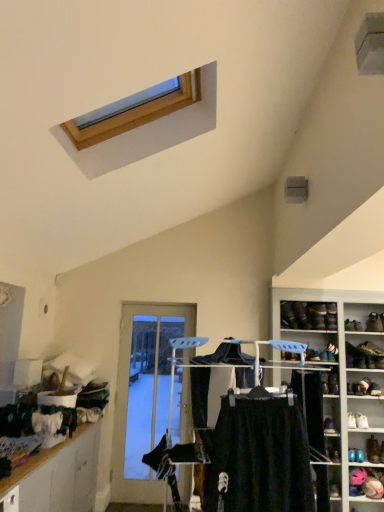
Question: From the image's perspective, is wooden cabinet at lower left located beneath black leather shoe at upper right, arranged as the first footwear when viewed from the top?

Choices:
 (A) yes
 (B) no

Answer: (A)

Question: Considering the relative positions of wooden cabinet at lower left and black leather shoe at upper right, placed as the 5th footwear when sorted from bottom to top, in the image provided, is wooden cabinet at lower left to the left of black leather shoe at upper right, placed as the 5th footwear when sorted from bottom to top, from the viewer's perspective?

Choices:
 (A) yes
 (B) no

Answer: (A)

Question: Considering the relative sizes of wooden cabinet at lower left and black leather shoe at upper right, placed as the 5th footwear when sorted from bottom to top, in the image provided, is wooden cabinet at lower left shorter than black leather shoe at upper right, placed as the 5th footwear when sorted from bottom to top,?

Choices:
 (A) no
 (B) yes

Answer: (A)

Question: Is black leather shoe at upper right, placed as the 5th footwear when sorted from bottom to top, at the back of wooden cabinet at lower left?

Choices:
 (A) no
 (B) yes

Answer: (A)

Question: From a real-world perspective, is wooden cabinet at lower left positioned under black leather shoe at upper right, arranged as the first footwear when viewed from the top, based on gravity?

Choices:
 (A) yes
 (B) no

Answer: (A)

Question: Does wooden cabinet at lower left touch black leather shoe at upper right, placed as the 5th footwear when sorted from bottom to top?

Choices:
 (A) yes
 (B) no

Answer: (B)

Question: From the image's perspective, is black leather shoe at upper right, arranged as the 7th shoe when viewed from the right, beneath wooden cabinet at lower left?

Choices:
 (A) no
 (B) yes

Answer: (A)

Question: Is black leather shoe at upper right, arranged as the 7th shoe when viewed from the right, in front of wooden cabinet at lower left?

Choices:
 (A) no
 (B) yes

Answer: (A)

Question: Is black leather shoe at upper right, arranged as the 7th shoe when viewed from the right, not within wooden cabinet at lower left?

Choices:
 (A) no
 (B) yes

Answer: (B)

Question: Can you confirm if black leather shoe at upper right, the 1th shoe positioned from the left, is shorter than wooden cabinet at lower left?

Choices:
 (A) no
 (B) yes

Answer: (B)

Question: From the image's perspective, is black leather shoe at upper right, which is counted as the 2th shoe, starting from the top, on wooden cabinet at lower left?

Choices:
 (A) yes
 (B) no

Answer: (A)

Question: Considering the relative sizes of black leather shoe at upper right, arranged as the 7th shoe when viewed from the right, and wooden cabinet at lower left in the image provided, is black leather shoe at upper right, arranged as the 7th shoe when viewed from the right, taller than wooden cabinet at lower left?

Choices:
 (A) yes
 (B) no

Answer: (B)

Question: Can you confirm if black fabric clothes at center is thinner than leather boot at right, the 5th shoe in the bottom-to-top sequence?

Choices:
 (A) no
 (B) yes

Answer: (A)